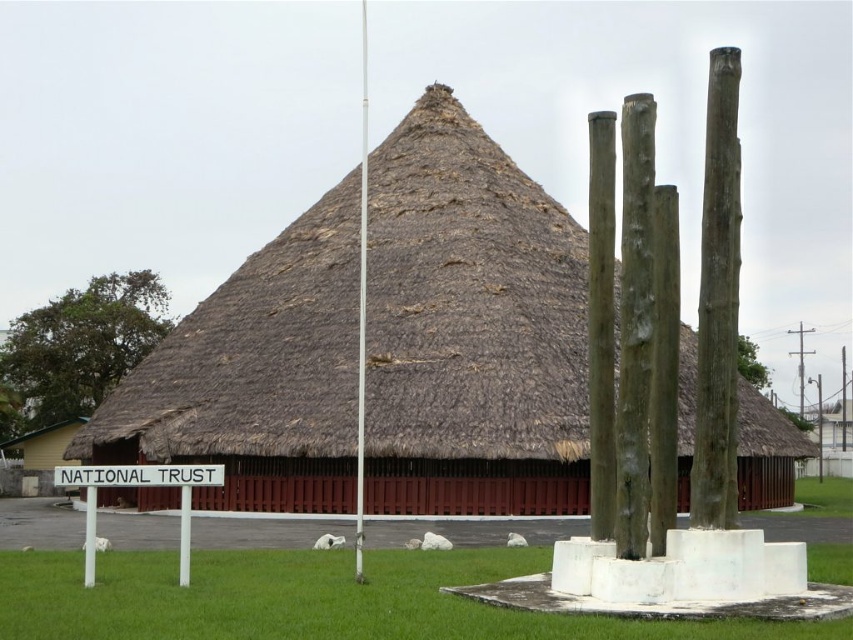
You are standing in front of the traditional building with a conical thatched roof. There is a sign mounted on two white posts in front of it. Where is the green grass at lower center located relative to the sign mounted on two white posts?

The green grass at lower center is located at point (x=315, y=600), which is to the right and slightly below the sign mounted on two white posts.

You are a visitor standing in front of the traditional building. You see the white plastic sign at lower left and the white smooth pole at center. Which object is shorter?

The white plastic sign at lower left is shorter than the white smooth pole at center.